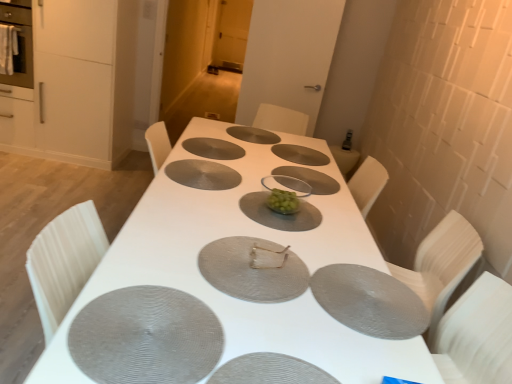
Identify the location of blank area beneath metallic silver pizza pan at center, positioned as the 5th pizza pan in back-to-front order (from a real-world perspective). (252, 263).